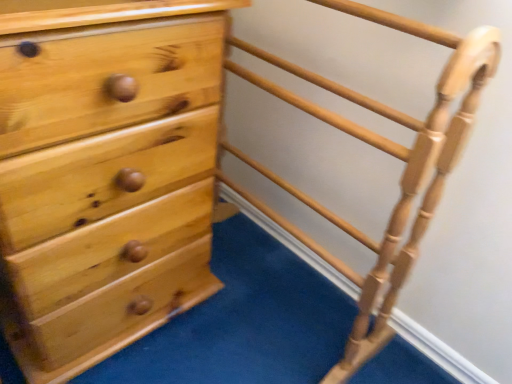
Identify the location of free spot below natural wood chair at upper right (from a real-world perspective). The width and height of the screenshot is (512, 384). (273, 305).